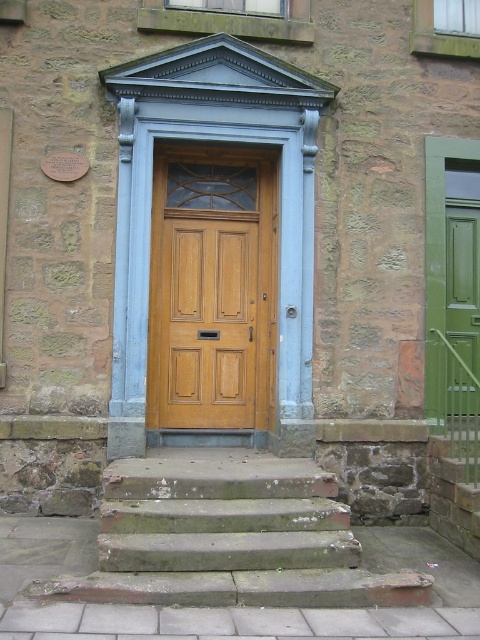
Does green stone stairs at center lie in front of wooden door at center?

Yes, it is.

Can you confirm if green stone stairs at center is shorter than wooden door at center?

Correct, green stone stairs at center is not as tall as wooden door at center.

Locate an element on the screen. green stone stairs at center is located at coordinates click(228, 538).